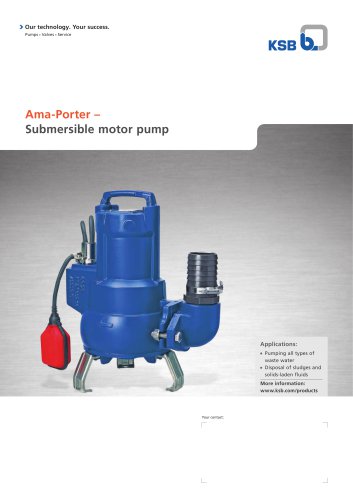
I want to click on outlet connection, so click(206, 281).